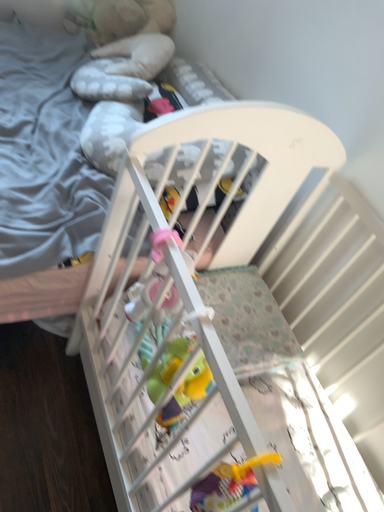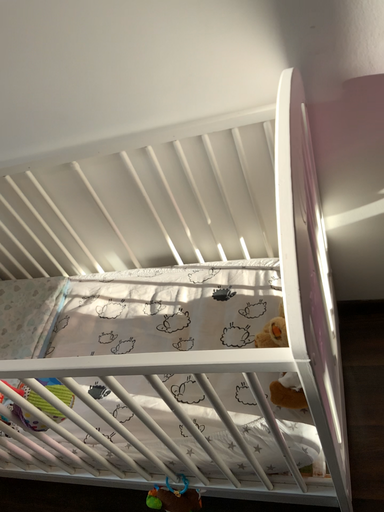
Question: Which way did the camera rotate in the video?

Choices:
 (A) rotated downward
 (B) rotated upward

Answer: (B)